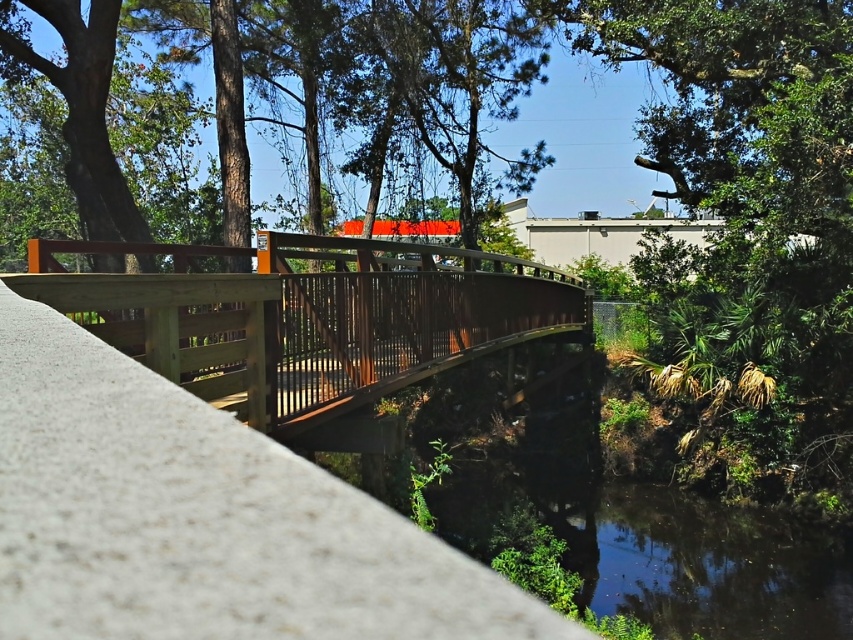
Question: Which point is closer to the camera?

Choices:
 (A) (335, 340)
 (B) (204, 580)

Answer: (B)

Question: Which of the following is the closest to the observer?

Choices:
 (A) (132, 497)
 (B) (564, 282)

Answer: (A)

Question: Is smooth concrete ledge at center in front of brown wooden bridge at center?

Choices:
 (A) yes
 (B) no

Answer: (A)

Question: Can you confirm if smooth concrete ledge at center is wider than brown wooden bridge at center?

Choices:
 (A) no
 (B) yes

Answer: (A)

Question: Which point appears closest to the camera in this image?

Choices:
 (A) (38, 244)
 (B) (59, 445)

Answer: (B)

Question: Is smooth concrete ledge at center wider than brown wooden bridge at center?

Choices:
 (A) no
 (B) yes

Answer: (A)